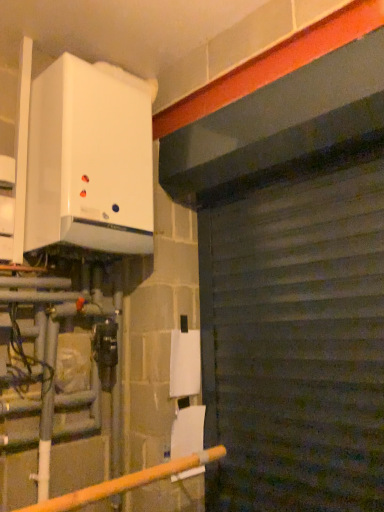
Measure the distance between point (x=28, y=210) and camera.

Point (x=28, y=210) is 1.68 meters from camera.

What is the approximate width of yellow matte pipe at lower left?

yellow matte pipe at lower left is 9.39 inches in width.

Locate an element on the screen. The height and width of the screenshot is (512, 384). dark gray corrugated metal at center is located at coordinates (296, 334).

From a real-world perspective, is yellow matte pipe at lower left physically above white glossy boiler at upper left?

Incorrect, from a real-world perspective, yellow matte pipe at lower left is lower than white glossy boiler at upper left.

Considering the positions of objects yellow matte pipe at lower left and white glossy boiler at upper left in the image provided, who is in front, yellow matte pipe at lower left or white glossy boiler at upper left?

yellow matte pipe at lower left is more forward.

From the image's perspective, who appears lower, yellow matte pipe at lower left or white glossy boiler at upper left?

yellow matte pipe at lower left is shown below in the image.

Considering the relative positions of dark gray corrugated metal at center and yellow matte pipe at lower left in the image provided, is dark gray corrugated metal at center to the left of yellow matte pipe at lower left from the viewer's perspective?

No.

This screenshot has height=512, width=384. What are the coordinates of `rail that is on the left side of dark gray corrugated metal at center` in the screenshot? It's located at (126, 482).

Considering the positions of points (290, 249) and (105, 487), is point (290, 249) closer to camera compared to point (105, 487)?

No, (290, 249) is behind (105, 487).

Considering the sizes of objects dark gray corrugated metal at center and yellow matte pipe at lower left in the image provided, who is smaller, dark gray corrugated metal at center or yellow matte pipe at lower left?

yellow matte pipe at lower left is smaller.

From a real-world perspective, is white glossy boiler at upper left on top of dark gray corrugated metal at center?

Indeed, from a real-world perspective, white glossy boiler at upper left stands above dark gray corrugated metal at center.

Which object is positioned more to the right, white glossy boiler at upper left or dark gray corrugated metal at center?

Positioned to the right is dark gray corrugated metal at center.

From the image's perspective, does white glossy boiler at upper left appear higher than dark gray corrugated metal at center?

Yes, from the image's perspective, white glossy boiler at upper left is above dark gray corrugated metal at center.

From a real-world perspective, is white glossy boiler at upper left on top of yellow matte pipe at lower left?

Yes, from a real-world perspective, white glossy boiler at upper left is over yellow matte pipe at lower left

At what (x,y) coordinates should I click in order to perform the action: click on rail on the right of white glossy boiler at upper left. Please return your answer as a coordinate pair (x, y). Looking at the image, I should click on (126, 482).

Is white glossy boiler at upper left far away from yellow matte pipe at lower left?

That's right, there is a large distance between white glossy boiler at upper left and yellow matte pipe at lower left.

Is the position of white glossy boiler at upper left less distant than that of yellow matte pipe at lower left?

No, it is not.

From the image's perspective, relative to white glossy boiler at upper left, is dark gray corrugated metal at center above or below?

Clearly, from the image's perspective, dark gray corrugated metal at center is below white glossy boiler at upper left.

Locate an element on the screen. The image size is (384, 512). garage door below the white glossy boiler at upper left (from the image's perspective) is located at coordinates (296, 334).

Is dark gray corrugated metal at center with white glossy boiler at upper left?

dark gray corrugated metal at center is not next to white glossy boiler at upper left, and they're not touching.

Does point (331, 492) come behind point (93, 221)?

No, (331, 492) is in front of (93, 221).

Could you tell me if yellow matte pipe at lower left is facing dark gray corrugated metal at center?

No, yellow matte pipe at lower left is not oriented towards dark gray corrugated metal at center.

Is yellow matte pipe at lower left positioned beyond the bounds of dark gray corrugated metal at center?

yellow matte pipe at lower left is positioned outside dark gray corrugated metal at center.

Locate an element on the screen. The height and width of the screenshot is (512, 384). garage door located on the right of yellow matte pipe at lower left is located at coordinates (296, 334).

Is yellow matte pipe at lower left to the right of dark gray corrugated metal at center from the viewer's perspective?

No, yellow matte pipe at lower left is not to the right of dark gray corrugated metal at center.

The width and height of the screenshot is (384, 512). Find the location of `rail that is on the right side of white glossy boiler at upper left`. rail that is on the right side of white glossy boiler at upper left is located at coordinates (126, 482).

At what (x,y) coordinates should I click in order to perform the action: click on garage door above the yellow matte pipe at lower left (from the image's perspective). Please return your answer as a coordinate pair (x, y). This screenshot has width=384, height=512. Looking at the image, I should click on (296, 334).

Which object lies further to the anchor point dark gray corrugated metal at center, yellow matte pipe at lower left or white glossy boiler at upper left?

white glossy boiler at upper left lies further to dark gray corrugated metal at center than the other object.

Estimate the real-world distances between objects in this image. Which object is closer to yellow matte pipe at lower left, white glossy boiler at upper left or dark gray corrugated metal at center?

dark gray corrugated metal at center.

Looking at the image, which one is located further to yellow matte pipe at lower left, dark gray corrugated metal at center or white glossy boiler at upper left?

white glossy boiler at upper left.

Based on their spatial positions, is dark gray corrugated metal at center or yellow matte pipe at lower left further from white glossy boiler at upper left?

Among the two, yellow matte pipe at lower left is located further to white glossy boiler at upper left.

When comparing their distances from white glossy boiler at upper left, does yellow matte pipe at lower left or dark gray corrugated metal at center seem further?

Among the two, yellow matte pipe at lower left is located further to white glossy boiler at upper left.

Looking at the image, which one is located further to dark gray corrugated metal at center, white glossy boiler at upper left or yellow matte pipe at lower left?

The object further to dark gray corrugated metal at center is white glossy boiler at upper left.

Image resolution: width=384 pixels, height=512 pixels. Identify the location of garage door between white glossy boiler at upper left and yellow matte pipe at lower left in the up-down direction. [296, 334].